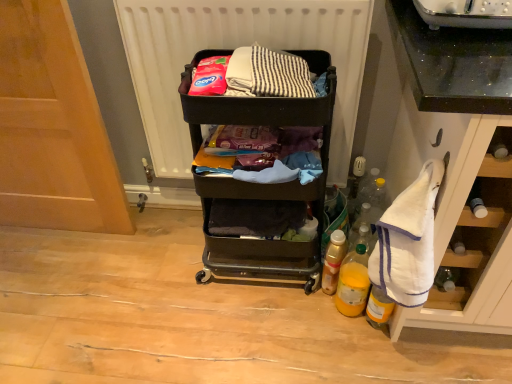
Where is `free space in front of translucent plastic bottle at lower right, the third bottle positioned from the right`? free space in front of translucent plastic bottle at lower right, the third bottle positioned from the right is located at coordinates (329, 329).